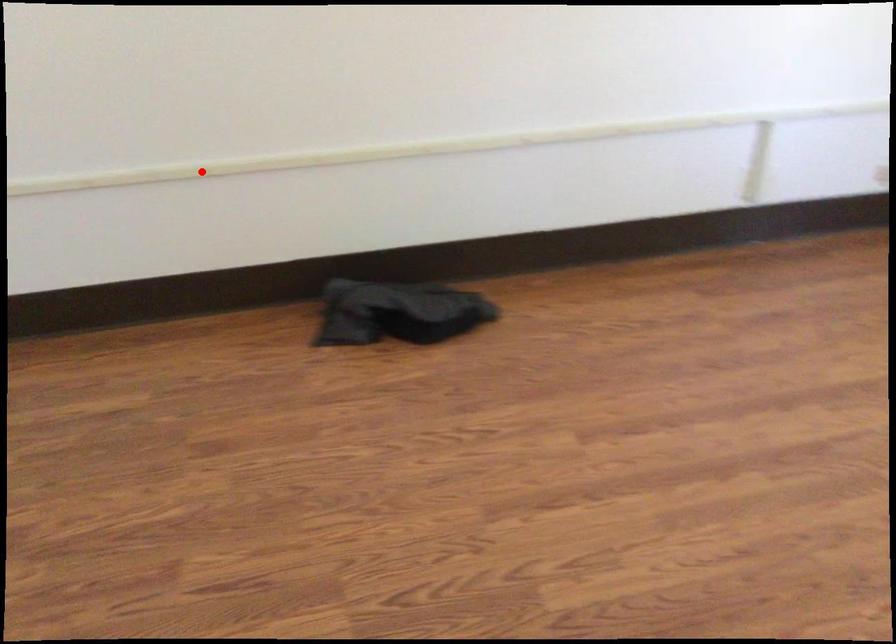
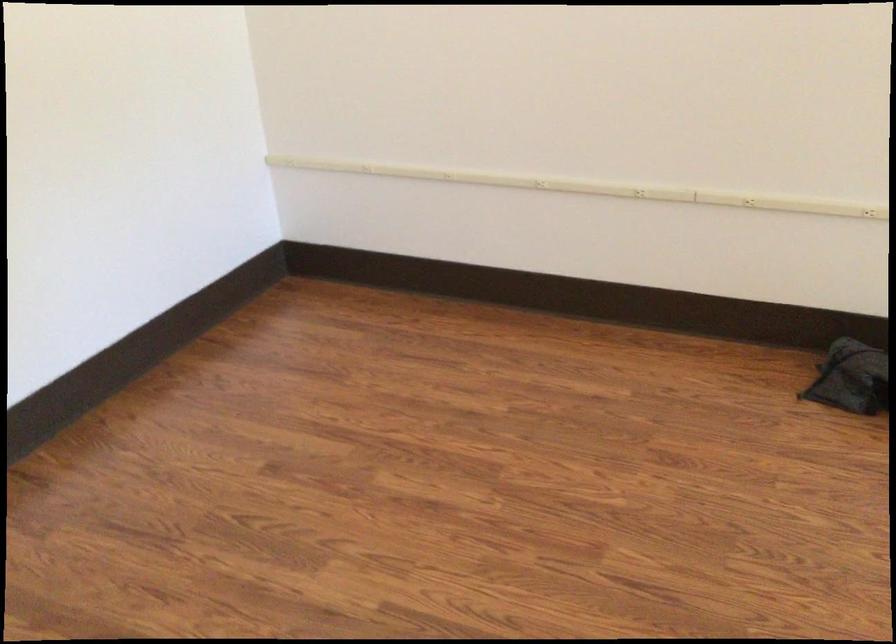
The point at the highlighted location is marked in the first image. Where is the corresponding point in the second image?

(747, 202)